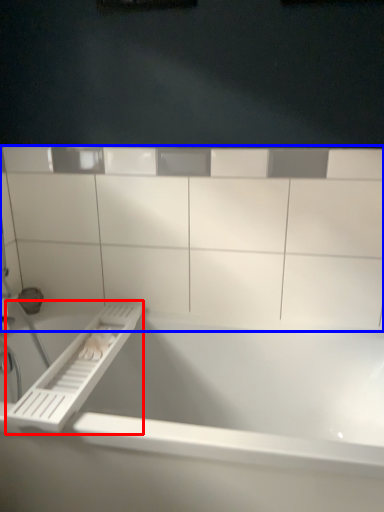
Question: Among these objects, which one is farthest to the camera, towel bar (highlighted by a red box) or ledge (highlighted by a blue box)?

Choices:
 (A) towel bar
 (B) ledge

Answer: (B)